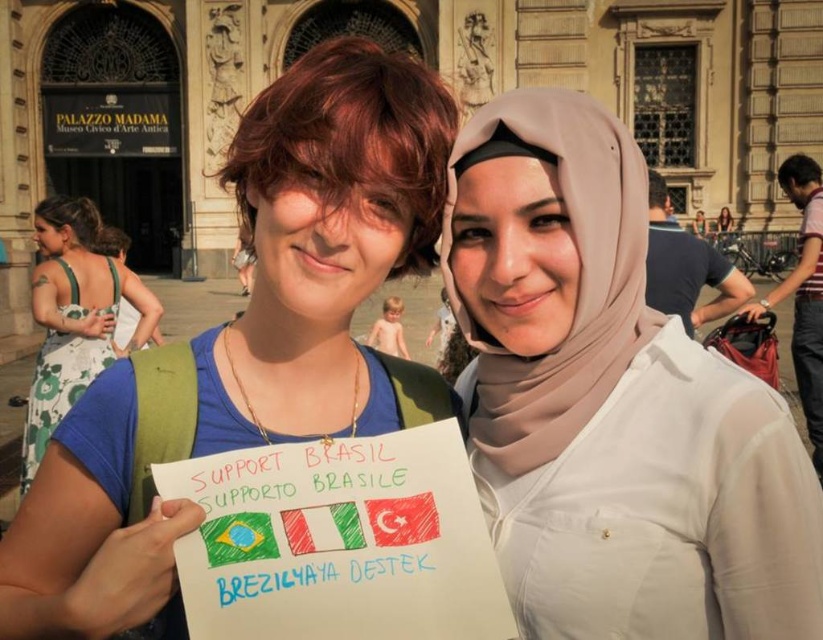
You are a photographer planning to take a group photo of the two people wearing the green floral dress at left and the white cotton dress at center. Since you want to ensure both dresses are visible, which dress should be placed closer to the camera to avoid being overshadowed by the other?

The green floral dress at left is wider than the white cotton dress at center, so placing the green floral dress at left closer to the camera will ensure its larger size doesn not block the smaller white cotton dress at center.

In the scene shown: You are a photographer trying to capture the beige fabric hijab at center and the white fabric hijab at upper center in the same frame. Based on their positions, which hijab is closer to the bottom of the image?

The beige fabric hijab at center is below the white fabric hijab at upper center, so the beige fabric hijab at center is closer to the bottom of the image.

You are a photographer trying to capture both the white fabric hijab at upper center and the white cotton dress at center in the same frame. Given that your camera has a fixed focal length, can you position yourself such that both objects are within the frame without moving either object?

The white fabric hijab at upper center and white cotton dress at center are 1.53 meters apart from each other. Since the distance between them is fixed, you can position yourself at a distance where the camera can capture both objects within the frame without moving them.